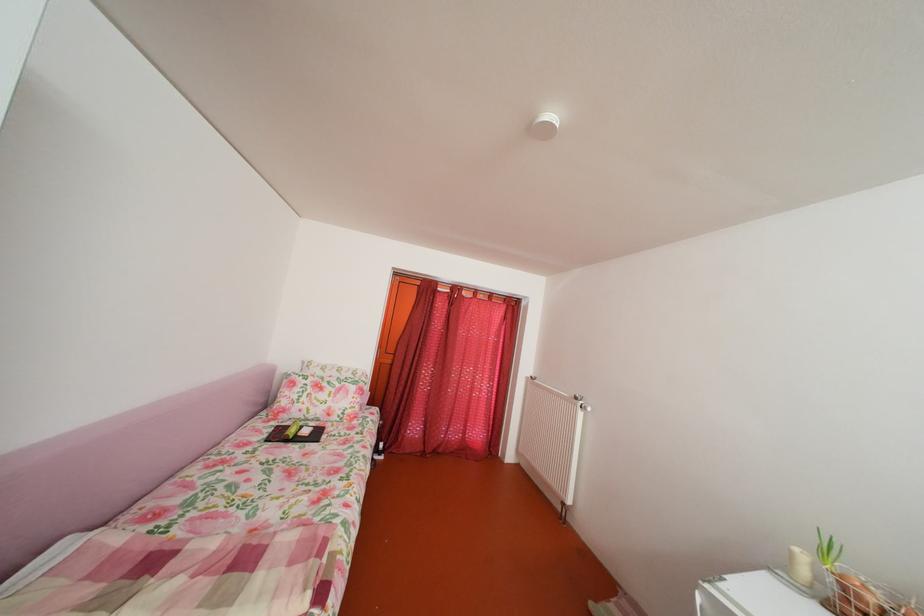
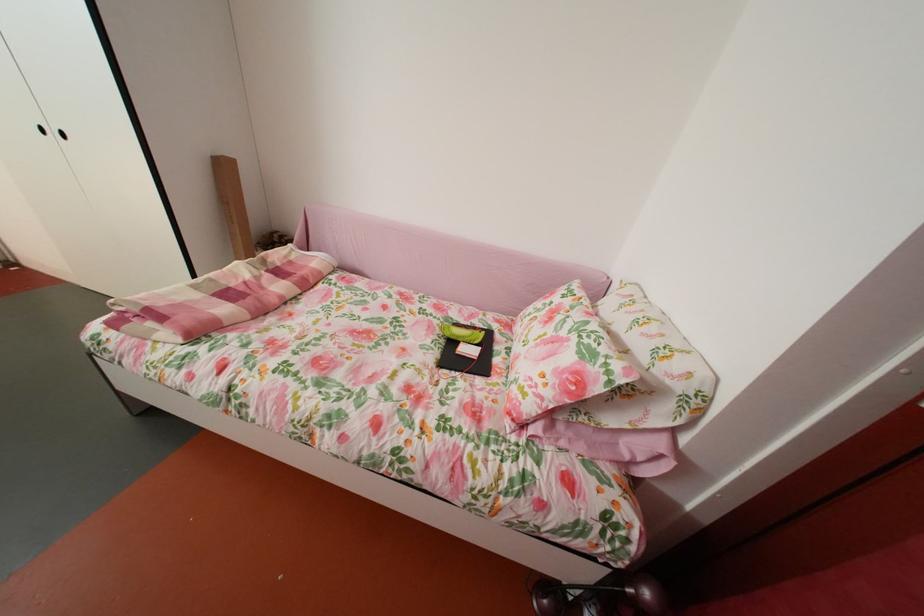
In the second image, find the point that corresponds to [276,442] in the first image.

(473, 328)